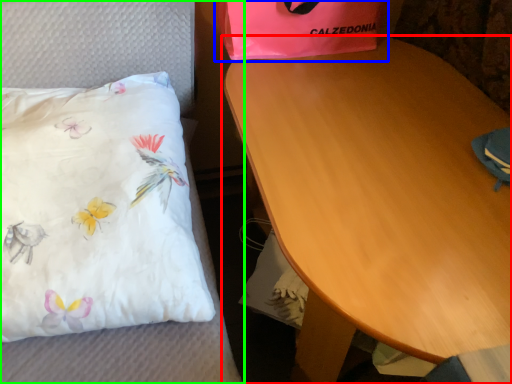
Question: Estimate the real-world distances between objects in this image. Which object is farther from table (highlighted by a red box), gift bag (highlighted by a blue box) or furniture (highlighted by a green box)?

Choices:
 (A) gift bag
 (B) furniture

Answer: (B)